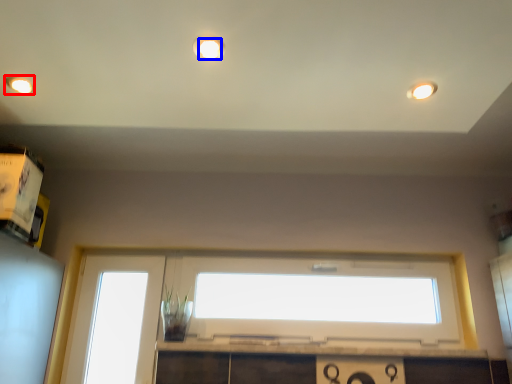
Question: Which of the following is the farthest to the observer, lighting (highlighted by a red box) or lighting (highlighted by a blue box)?

Choices:
 (A) lighting
 (B) lighting

Answer: (A)